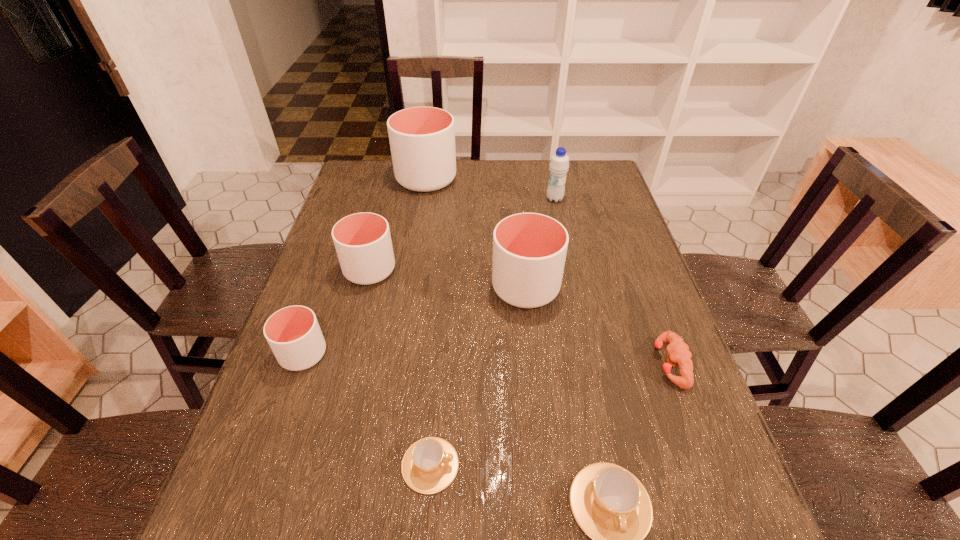
Locate an element on the screen. This screenshot has width=960, height=540. the tallest cup is located at coordinates (422, 139).

Locate an element on the screen. the farthest white cup is located at coordinates (422, 139).

You are a GUI agent. You are given a task and a screenshot of the screen. Output one action in this format:
    pyautogui.click(x=<x>, y=<y>)
    Task: Click on the water bottle
    Image resolution: width=960 pixels, height=540 pixels.
    Given the screenshot: What is the action you would take?
    [559, 164]

The height and width of the screenshot is (540, 960). I want to click on the second biggest white cup, so click(x=529, y=249).

I want to click on the rightmost white cup, so click(x=529, y=249).

Where is `the fourth tallest object`? The height and width of the screenshot is (540, 960). the fourth tallest object is located at coordinates (362, 241).

The height and width of the screenshot is (540, 960). What are the coordinates of `the second smallest white cup` in the screenshot? It's located at (362, 241).

Find the location of `the fourth farthest cup`. the fourth farthest cup is located at coordinates pos(293,333).

You are a GUI agent. You are given a task and a screenshot of the screen. Output one action in this format:
    pyautogui.click(x=<x>, y=<y>)
    Task: Click on the fourth tallest cup
    The width and height of the screenshot is (960, 540).
    Given the screenshot: What is the action you would take?
    pyautogui.click(x=293, y=333)

Where is `red puncher`? red puncher is located at coordinates (678, 352).